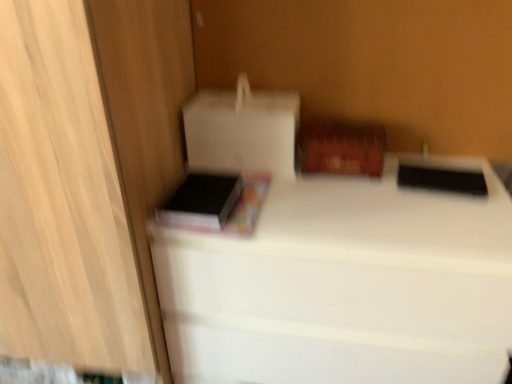
Question: Does cardboard box at upper right, the 2th cardboard box viewed from the left, have a larger size compared to white matte bed at center?

Choices:
 (A) yes
 (B) no

Answer: (B)

Question: From a real-world perspective, is cardboard box at upper right, the 2th cardboard box viewed from the left, positioned under white matte bed at center based on gravity?

Choices:
 (A) yes
 (B) no

Answer: (B)

Question: Is the position of cardboard box at upper right, the 2th cardboard box viewed from the left, more distant than that of white matte bed at center?

Choices:
 (A) no
 (B) yes

Answer: (B)

Question: Does cardboard box at upper right, the 2th cardboard box viewed from the left, have a lesser width compared to white matte bed at center?

Choices:
 (A) no
 (B) yes

Answer: (B)

Question: From a real-world perspective, is cardboard box at upper right, the 2th cardboard box viewed from the left, located higher than white matte bed at center?

Choices:
 (A) yes
 (B) no

Answer: (A)

Question: Does cardboard box at upper right, the 2th cardboard box viewed from the left, have a greater width compared to white matte bed at center?

Choices:
 (A) yes
 (B) no

Answer: (B)

Question: From the image's perspective, is white matte cardboard box at upper left, which is counted as the first cardboard box, starting from the left, located beneath cardboard box at upper right, marked as the 1th cardboard box in a right-to-left arrangement?

Choices:
 (A) no
 (B) yes

Answer: (A)

Question: Considering the relative sizes of white matte cardboard box at upper left, marked as the 2th cardboard box in a right-to-left arrangement, and cardboard box at upper right, the 2th cardboard box viewed from the left, in the image provided, is white matte cardboard box at upper left, marked as the 2th cardboard box in a right-to-left arrangement, wider than cardboard box at upper right, the 2th cardboard box viewed from the left,?

Choices:
 (A) no
 (B) yes

Answer: (B)

Question: Considering the relative sizes of white matte cardboard box at upper left, which is counted as the first cardboard box, starting from the left, and cardboard box at upper right, the 2th cardboard box viewed from the left, in the image provided, is white matte cardboard box at upper left, which is counted as the first cardboard box, starting from the left, shorter than cardboard box at upper right, the 2th cardboard box viewed from the left,?

Choices:
 (A) no
 (B) yes

Answer: (A)

Question: Can we say white matte cardboard box at upper left, which is counted as the first cardboard box, starting from the left, lies outside cardboard box at upper right, marked as the 1th cardboard box in a right-to-left arrangement?

Choices:
 (A) yes
 (B) no

Answer: (A)

Question: Is white matte cardboard box at upper left, marked as the 2th cardboard box in a right-to-left arrangement, behind cardboard box at upper right, the 2th cardboard box viewed from the left?

Choices:
 (A) yes
 (B) no

Answer: (B)

Question: Considering the relative sizes of white matte cardboard box at upper left, which is counted as the first cardboard box, starting from the left, and cardboard box at upper right, the 2th cardboard box viewed from the left, in the image provided, is white matte cardboard box at upper left, which is counted as the first cardboard box, starting from the left, taller than cardboard box at upper right, the 2th cardboard box viewed from the left,?

Choices:
 (A) no
 (B) yes

Answer: (B)

Question: Is white matte bed at center facing towards white matte cardboard box at upper left, marked as the 2th cardboard box in a right-to-left arrangement?

Choices:
 (A) yes
 (B) no

Answer: (B)